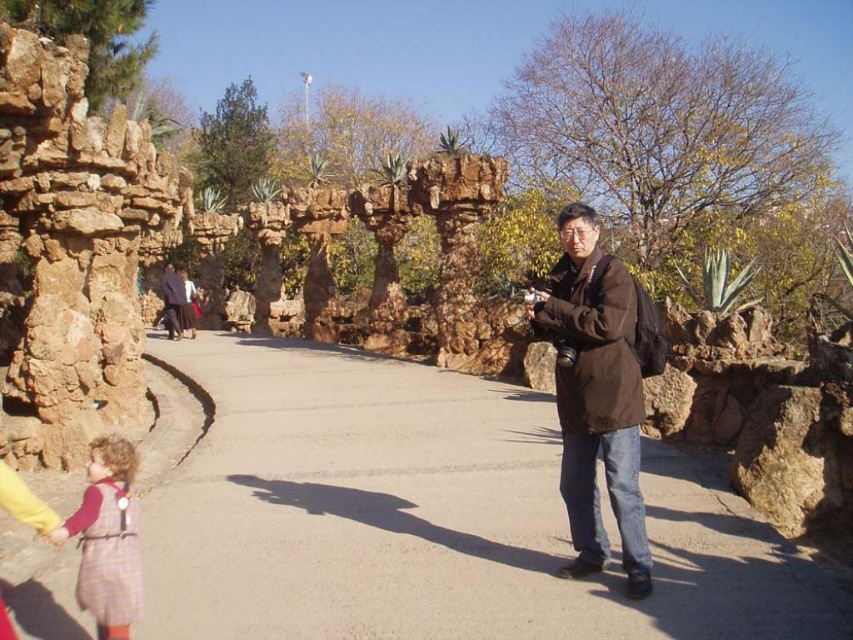
Between point (115, 330) and point (578, 257), which one is positioned behind?

Positioned behind is point (115, 330).

In the scene shown: Between brown rough stone at left and brown matte jacket at center-right, which one has more height?

brown rough stone at left is taller.

Who is more forward, (105, 173) or (622, 317)?

Point (622, 317) is more forward.

Where is `brown rough stone at left`? The height and width of the screenshot is (640, 853). brown rough stone at left is located at coordinates (74, 250).

Between point (112, 396) and point (122, 512), which one is positioned in front?

Point (122, 512)

Is brown rough stone at left thinner than plaid fabric dress at lower left?

Indeed, brown rough stone at left has a lesser width compared to plaid fabric dress at lower left.

Describe the element at coordinates (74, 250) in the screenshot. I see `brown rough stone at left` at that location.

What are the coordinates of `brown rough stone at left` in the screenshot? It's located at (74, 250).

What do you see at coordinates (595, 394) in the screenshot?
I see `brown matte jacket at center-right` at bounding box center [595, 394].

Between brown matte jacket at center-right and plaid fabric dress at lower left, which one has less height?

plaid fabric dress at lower left

You are a GUI agent. You are given a task and a screenshot of the screen. Output one action in this format:
    pyautogui.click(x=<x>, y=<y>)
    Task: Click on the brown matte jacket at center-right
    
    Given the screenshot: What is the action you would take?
    pyautogui.click(x=595, y=394)

What are the coordinates of `brown matte jacket at center-right` in the screenshot? It's located at (595, 394).